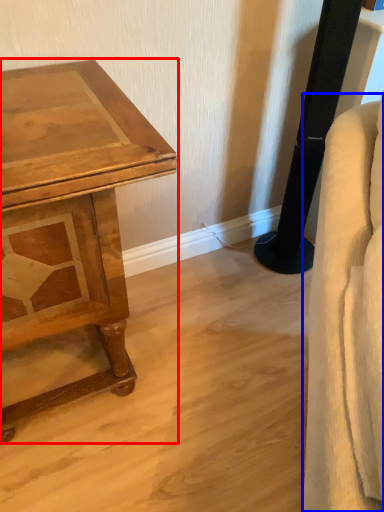
Question: Which point is further to the camera, table (highlighted by a red box) or swivel chair (highlighted by a blue box)?

Choices:
 (A) table
 (B) swivel chair

Answer: (A)